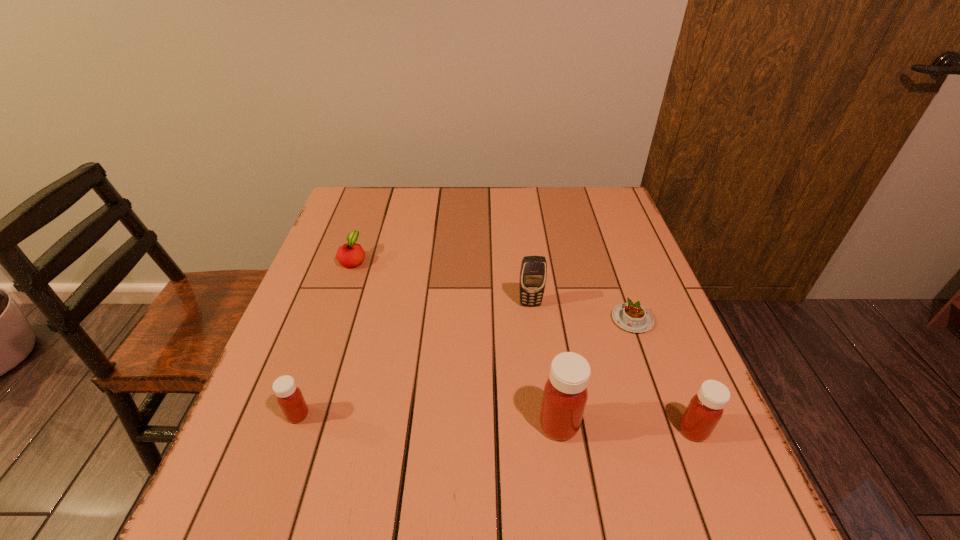
In order to click on medicine object that ranks as the third closest to the cellular telephone in this screenshot , I will do `click(289, 397)`.

Select which medicine appears as the second closest to the third tallest object. Please provide its 2D coordinates. Your answer should be formatted as a tuple, i.e. [(x, y)], where the tuple contains the x and y coordinates of a point satisfying the conditions above.

[(289, 397)]

You are a GUI agent. You are given a task and a screenshot of the screen. Output one action in this format:
    pyautogui.click(x=<x>, y=<y>)
    Task: Click on the free region that satisfies the following two spatial constraints: 1. on the front side of the farthest object; 2. on the left side of the pudding
    The width and height of the screenshot is (960, 540).
    Given the screenshot: What is the action you would take?
    pyautogui.click(x=332, y=320)

Image resolution: width=960 pixels, height=540 pixels. In order to click on vacant space that satisfies the following two spatial constraints: 1. on the back side of the shortest medicine; 2. on the right side of the shortest object in this screenshot , I will do `click(331, 320)`.

Identify the location of free point that satisfies the following two spatial constraints: 1. on the back side of the pudding; 2. on the left side of the tallest object. (543, 320).